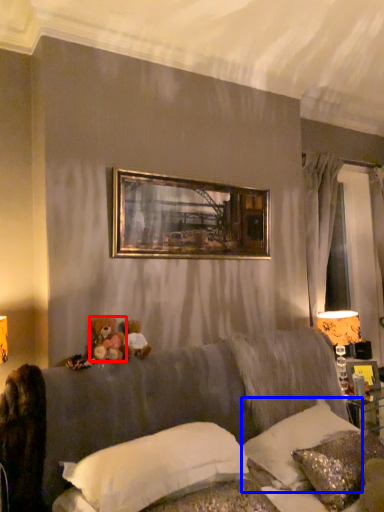
Question: Which object appears farthest to the camera in this image, toy (highlighted by a red box) or pillow (highlighted by a blue box)?

Choices:
 (A) toy
 (B) pillow

Answer: (A)